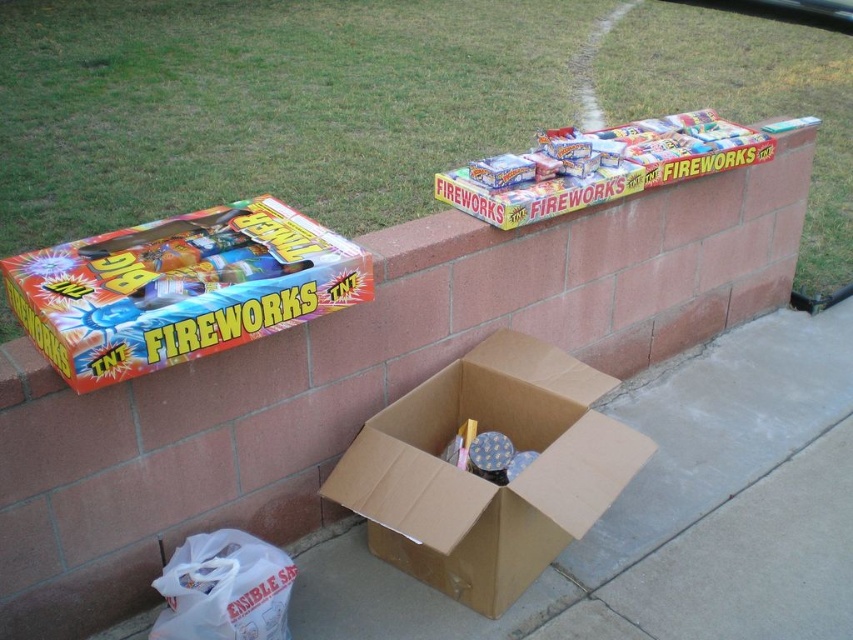
You are standing at the edge of the concrete surface and want to pick up both the brown cardboard box at lower center and the white plastic bag at lower left. Which object should you move towards first if you want to start with the one closer to your current position?

The white plastic bag at lower left is closer to your current position since it is to the left of the brown cardboard box at lower center.

You are a delivery person who needs to place a new item on top of the orange glossy fireworks box at left and the white plastic bag at lower left. Which object should you choose to place the item on if you want it to be higher?

The orange glossy fireworks box at left has a greater height compared to the white plastic bag at lower left, so placing the item on top of the orange glossy fireworks box at left will result in the item being higher.